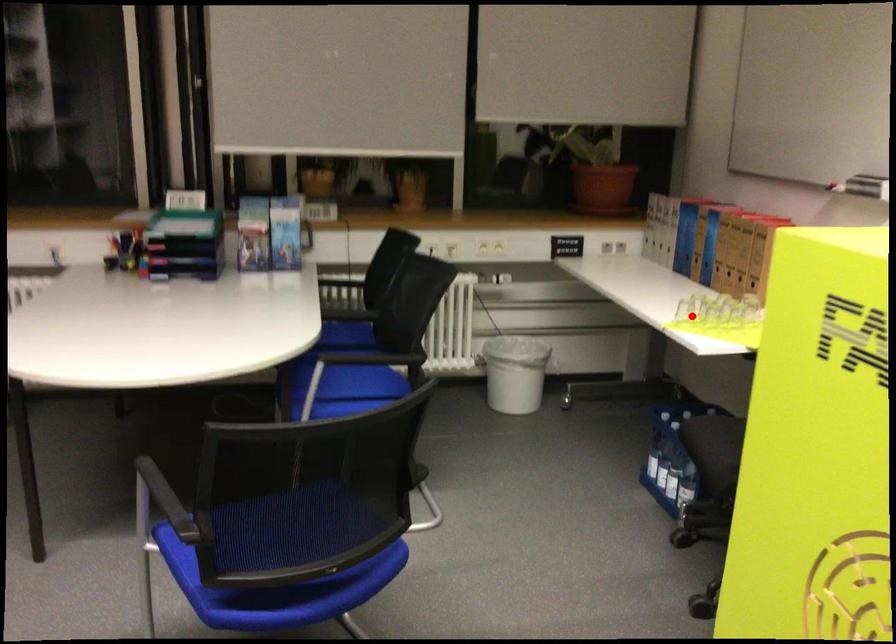
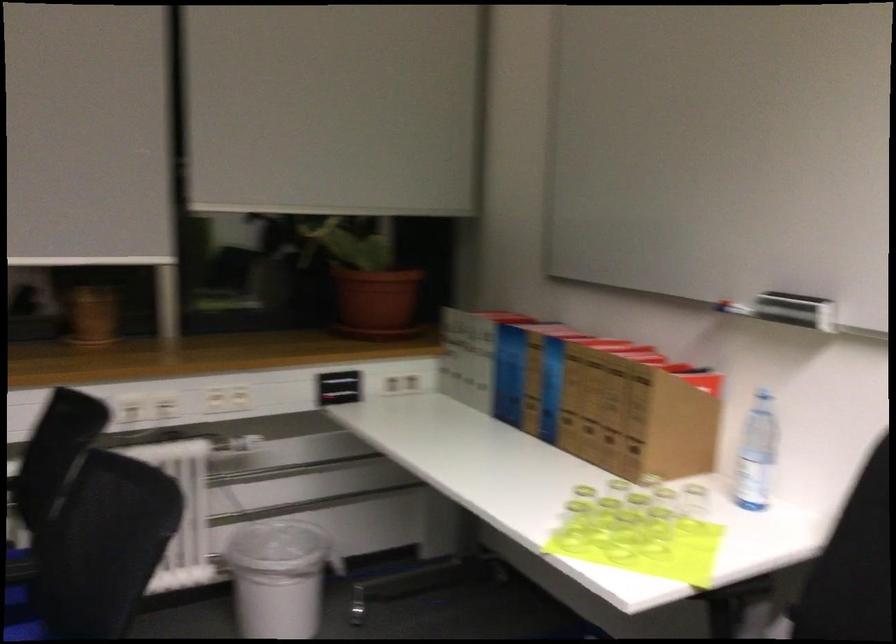
Question: I am providing you with two images of the same scene from different viewpoints. A red point is marked on the first image. Can you still see the location of the red point in image 2?

Choices:
 (A) Yes
 (B) No

Answer: (A)